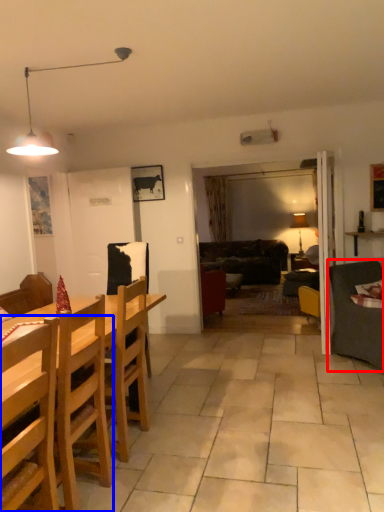
Question: Which object appears farthest to the camera in this image, studio couch (highlighted by a red box) or chair (highlighted by a blue box)?

Choices:
 (A) studio couch
 (B) chair

Answer: (A)